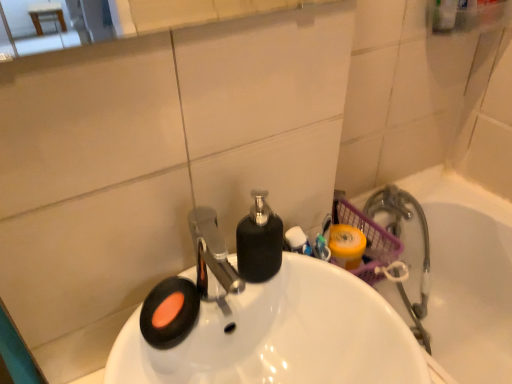
Question: From a real-world perspective, is white glossy sink at center beneath translucent plastic basket at right?

Choices:
 (A) yes
 (B) no

Answer: (B)

Question: Is white glossy sink at center behind translucent plastic basket at right?

Choices:
 (A) yes
 (B) no

Answer: (B)

Question: Would you say white glossy sink at center is a long distance from translucent plastic basket at right?

Choices:
 (A) no
 (B) yes

Answer: (A)

Question: Considering the relative sizes of white glossy sink at center and translucent plastic basket at right in the image provided, is white glossy sink at center thinner than translucent plastic basket at right?

Choices:
 (A) yes
 (B) no

Answer: (B)

Question: Is translucent plastic basket at right a part of white glossy sink at center?

Choices:
 (A) yes
 (B) no

Answer: (B)

Question: From the image's perspective, is white glossy sink at center over translucent plastic basket at right?

Choices:
 (A) no
 (B) yes

Answer: (B)

Question: Is translucent plastic basket at right smaller than white glossy sink at center?

Choices:
 (A) yes
 (B) no

Answer: (B)

Question: Considering the relative sizes of translucent plastic basket at right and white glossy sink at center in the image provided, is translucent plastic basket at right thinner than white glossy sink at center?

Choices:
 (A) no
 (B) yes

Answer: (B)

Question: Does translucent plastic basket at right have a greater width compared to white glossy sink at center?

Choices:
 (A) no
 (B) yes

Answer: (A)

Question: Does translucent plastic basket at right have a larger size compared to white glossy sink at center?

Choices:
 (A) yes
 (B) no

Answer: (A)

Question: Is translucent plastic basket at right located outside white glossy sink at center?

Choices:
 (A) yes
 (B) no

Answer: (A)

Question: From the image's perspective, is translucent plastic basket at right under white glossy sink at center?

Choices:
 (A) yes
 (B) no

Answer: (A)

Question: Considering the relative positions of white glossy sink at center and translucent plastic basket at right in the image provided, is white glossy sink at center to the left or to the right of translucent plastic basket at right?

Choices:
 (A) right
 (B) left

Answer: (B)